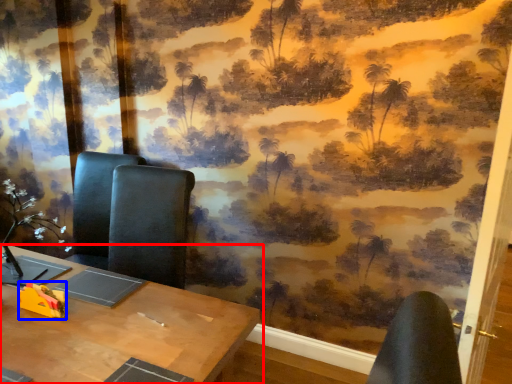
Question: Which object appears farthest to the camera in this image, table (highlighted by a red box) or toy (highlighted by a blue box)?

Choices:
 (A) table
 (B) toy

Answer: (B)